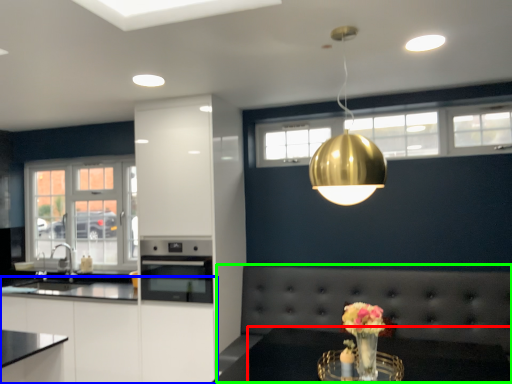
Question: Based on their relative distances, which object is farther from table (highlighted by a red box)? Choose from cabinetry (highlighted by a blue box) and couch (highlighted by a green box).

Choices:
 (A) cabinetry
 (B) couch

Answer: (A)